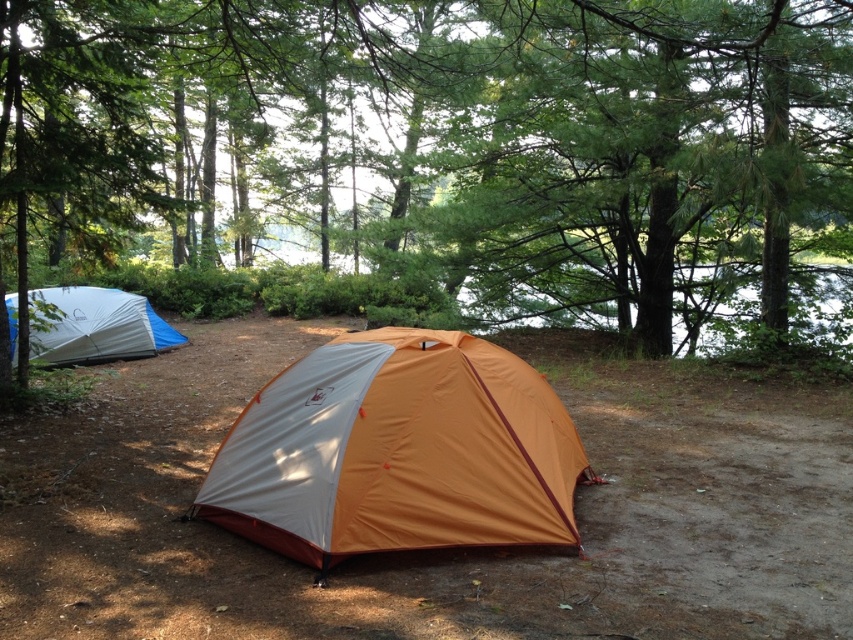
You are planning to set up a picnic table between the green leafy tree at center and the blue tarp tent at left. Which object will the picnic table be closer to?

The picnic table will be closer to the blue tarp tent at left because the green leafy tree at center is much taller than the blue tarp tent at left, implying it is further away.